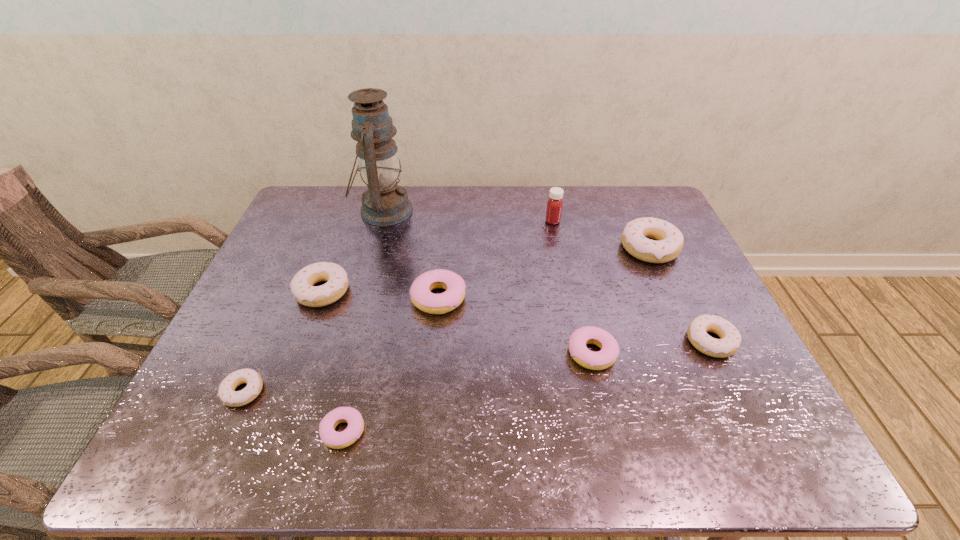
At what (x,y) coordinates should I click in order to perform the action: click on the rightmost pink doughnut. Please return your answer as a coordinate pair (x, y). The height and width of the screenshot is (540, 960). Looking at the image, I should click on (606, 357).

Identify the location of the second nearest doughnut. (227, 394).

Locate an element on the screen. The height and width of the screenshot is (540, 960). the nearest white doughnut is located at coordinates (227, 394).

The image size is (960, 540). Identify the location of the nearest pink doughnut. (331, 438).

You are a GUI agent. You are given a task and a screenshot of the screen. Output one action in this format:
    pyautogui.click(x=<x>, y=<y>)
    Task: Click on the smallest pink doughnut
    This screenshot has height=540, width=960.
    Given the screenshot: What is the action you would take?
    pyautogui.click(x=331, y=438)

Locate an element on the screen. This screenshot has width=960, height=540. vacant space located on the right of the tallest object is located at coordinates point(480,211).

Locate an element on the screen. vacant space located on the back of the eighth shortest object is located at coordinates (545, 186).

Where is `blank space located 0.050m on the front of the seventh shortest object`? blank space located 0.050m on the front of the seventh shortest object is located at coordinates (663, 280).

This screenshot has width=960, height=540. What are the coordinates of `free space located on the left of the second farthest white doughnut` in the screenshot? It's located at (262, 291).

You are a GUI agent. You are given a task and a screenshot of the screen. Output one action in this format:
    pyautogui.click(x=<x>, y=<y>)
    Task: Click on the vacant region located 0.140m on the front of the second pink doughnut from right to left
    Image resolution: width=960 pixels, height=540 pixels.
    Given the screenshot: What is the action you would take?
    pyautogui.click(x=432, y=362)